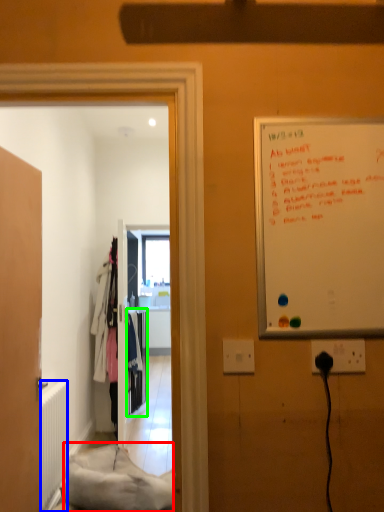
Question: Which is nearer to the material (highlighted by a red box)? radiator (highlighted by a blue box) or closet (highlighted by a green box).

Choices:
 (A) radiator
 (B) closet

Answer: (A)